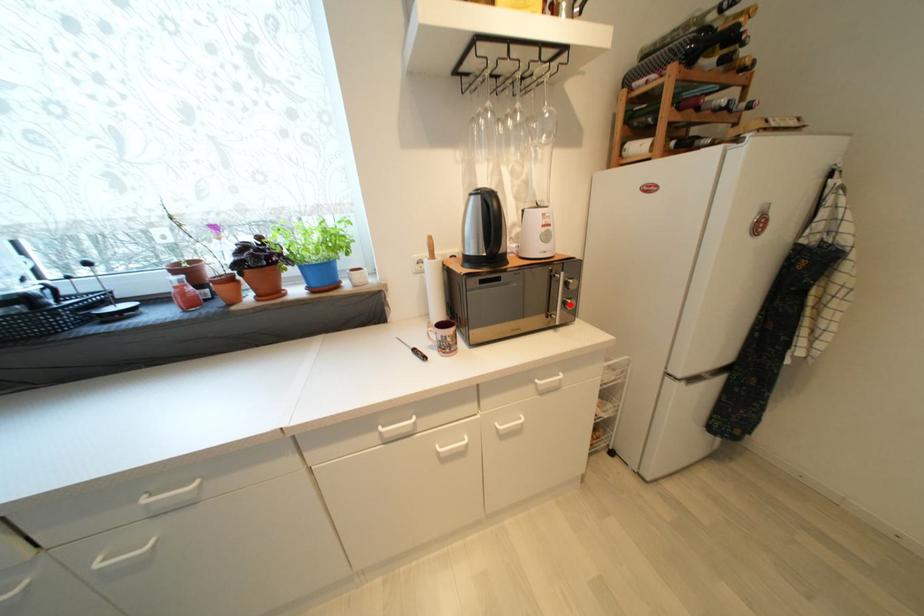
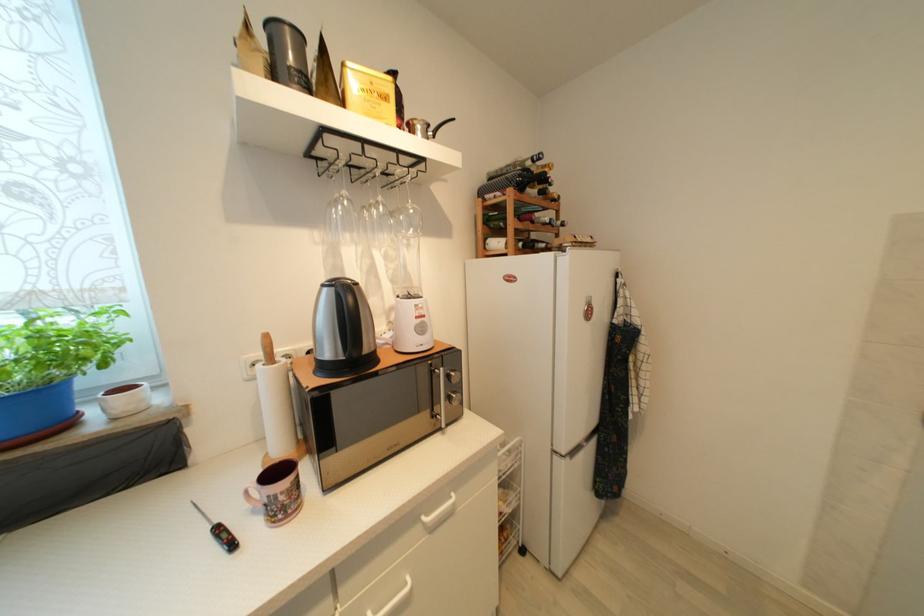
In the second image, find the point that corresponds to the highlighted location in the first image.

(455, 400)